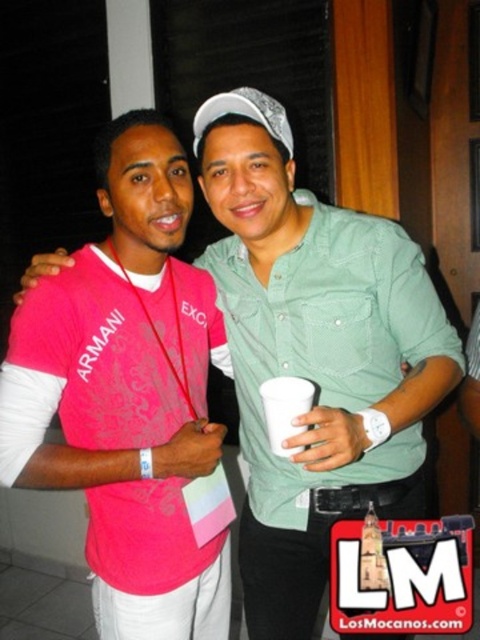
Question: Is pink fabric shirt at center wider than white paper cup at center?

Choices:
 (A) yes
 (B) no

Answer: (A)

Question: Which point is farther to the camera?

Choices:
 (A) white paper cup at center
 (B) pink fabric shirt at center

Answer: (B)

Question: Where is pink fabric shirt at center located in relation to white paper cup at center in the image?

Choices:
 (A) right
 (B) left

Answer: (B)

Question: Which object is closer to the camera taking this photo?

Choices:
 (A) white paper cup at center
 (B) pink fabric shirt at center

Answer: (A)

Question: Which of the following is the closest to the observer?

Choices:
 (A) white paper cup at center
 (B) pink fabric shirt at center

Answer: (A)

Question: Does pink fabric shirt at center appear under white paper cup at center?

Choices:
 (A) yes
 (B) no

Answer: (A)